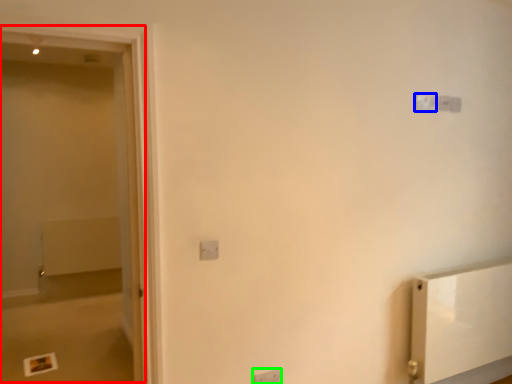
Question: Considering the real-world distances, which object is closest to screen door (highlighted by a red box)? light switch (highlighted by a blue box) or light switch (highlighted by a green box).

Choices:
 (A) light switch
 (B) light switch

Answer: (B)